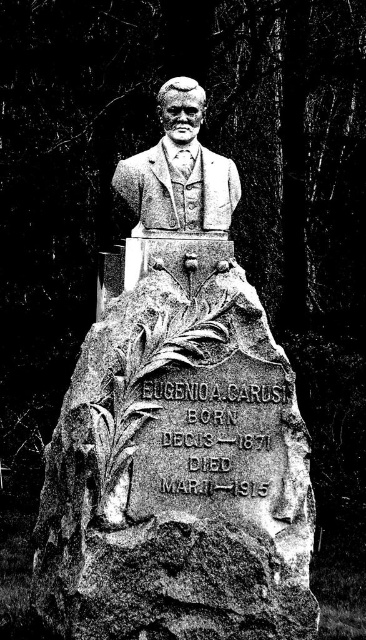
Question: Is stone statue at center positioned before polished stone bust at center?

Choices:
 (A) no
 (B) yes

Answer: (B)

Question: Among these points, which one is farthest from the camera?

Choices:
 (A) (148, 173)
 (B) (154, 243)

Answer: (A)

Question: Among these objects, which one is farthest from the camera?

Choices:
 (A) stone statue at center
 (B) polished stone bust at center

Answer: (B)

Question: Does stone statue at center lie in front of polished stone bust at center?

Choices:
 (A) yes
 (B) no

Answer: (A)

Question: Does stone statue at center have a larger size compared to polished stone bust at center?

Choices:
 (A) yes
 (B) no

Answer: (A)